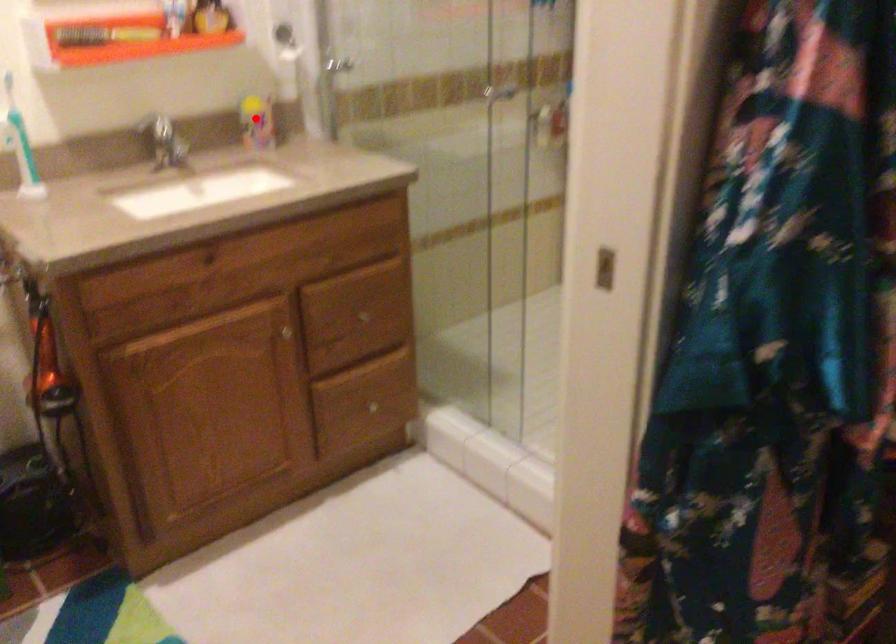
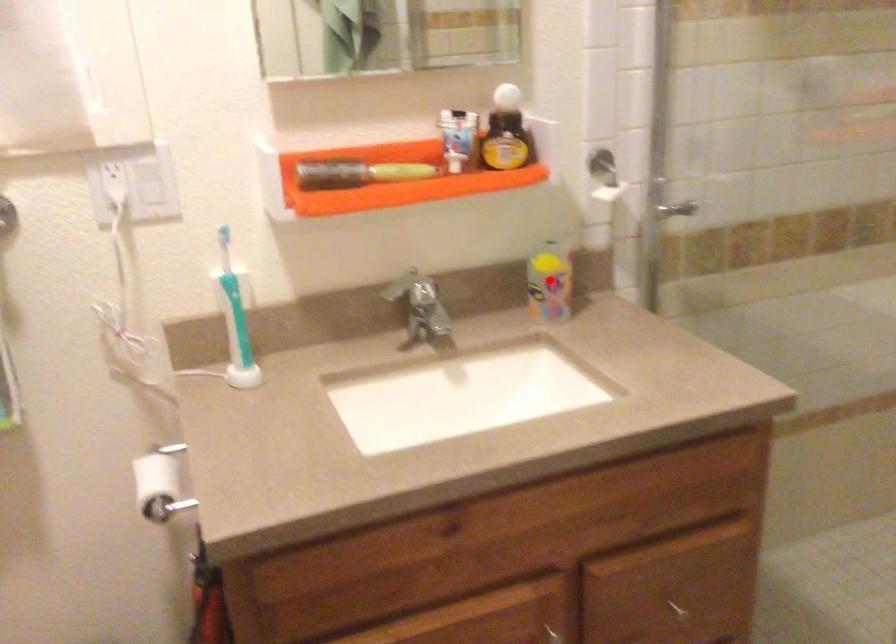
I am providing you with two images of the same scene from different viewpoints. A red point is marked on the first image and another point is marked on the second image. Are the points marked in image1 and image2 representing the same 3D position?

Yes